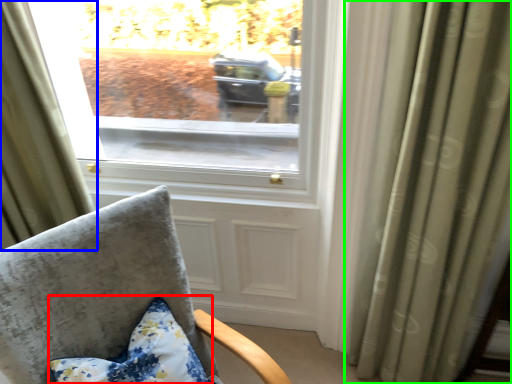
Question: Which is farther away from pillow (highlighted by a red box)? curtain (highlighted by a blue box) or curtain (highlighted by a green box)?

Choices:
 (A) curtain
 (B) curtain

Answer: (B)